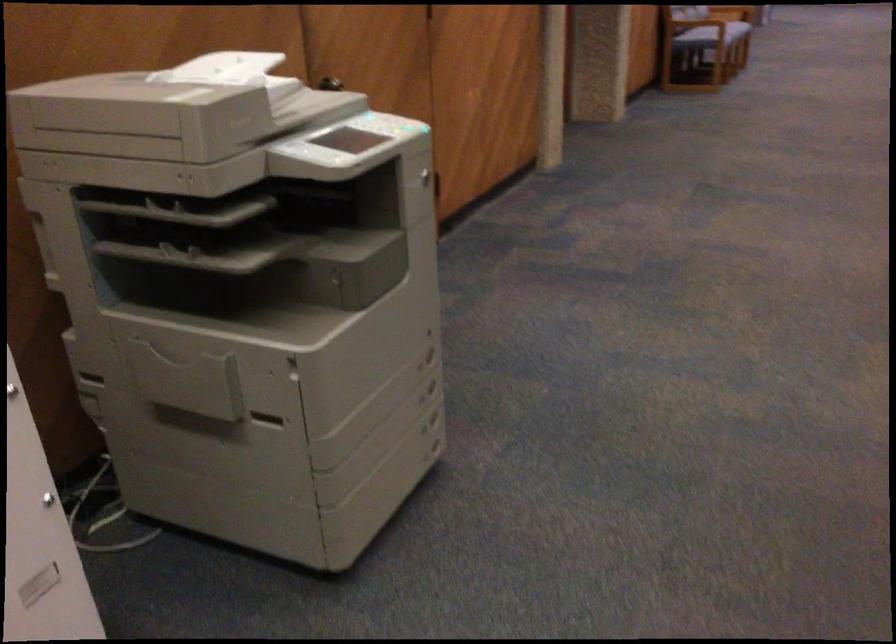
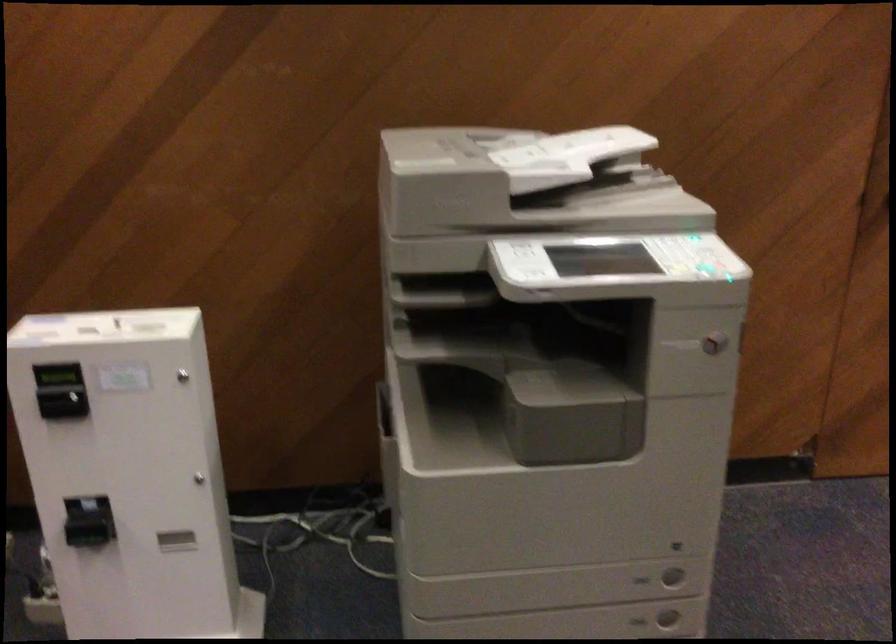
Find the pixel in the second image that matches pixel 426 371 in the first image.

(642, 580)